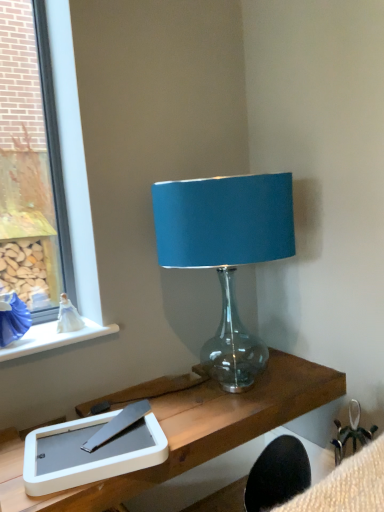
Question: Choose the correct answer: Is clear glass window at left inside white ceramic window sill at upper left or outside it?

Choices:
 (A) inside
 (B) outside

Answer: (B)

Question: Considering the positions of clear glass window at left and white ceramic window sill at upper left in the image, is clear glass window at left wider or thinner than white ceramic window sill at upper left?

Choices:
 (A) thin
 (B) wide

Answer: (A)

Question: Based on their relative distances, which object is nearer to the clear glass window at left?

Choices:
 (A) teal fabric lampshade at upper center
 (B) white ceramic window sill at upper left
 (C) white matte tablet at lower left

Answer: (B)

Question: Which object is positioned closest to the teal fabric lampshade at upper center?

Choices:
 (A) white ceramic window sill at upper left
 (B) clear glass window at left
 (C) white matte tablet at lower left

Answer: (B)